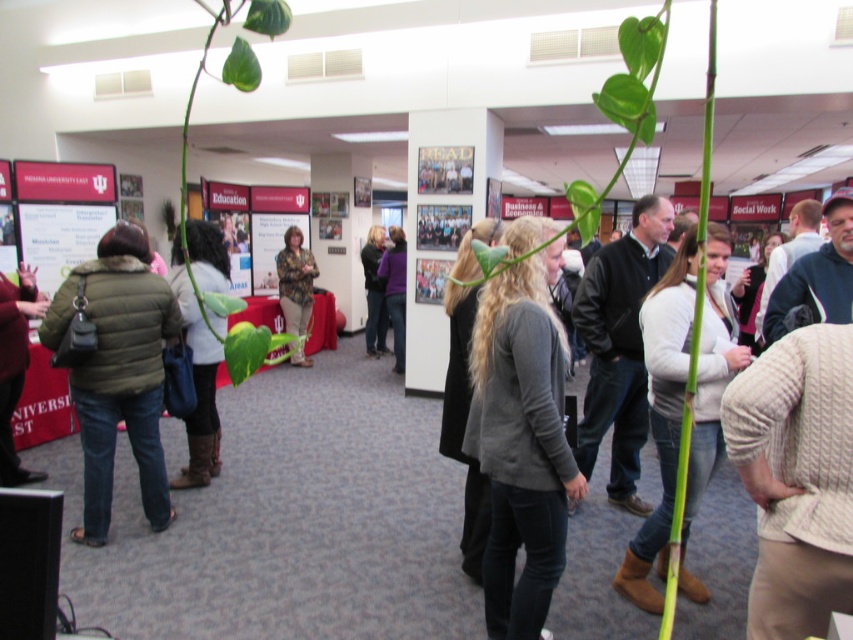
Can you confirm if gray sweater at center is positioned to the left of purple matte jacket at center?

Incorrect, gray sweater at center is not on the left side of purple matte jacket at center.

Who is lower down, gray sweater at center or purple matte jacket at center?

gray sweater at center is below.

This screenshot has height=640, width=853. What do you see at coordinates (521, 432) in the screenshot?
I see `gray sweater at center` at bounding box center [521, 432].

Where is `gray sweater at center`? This screenshot has width=853, height=640. gray sweater at center is located at coordinates (521, 432).

Which of these two, gray sweater at center or dark gray sweater at center, stands shorter?

Standing shorter between the two is gray sweater at center.

This screenshot has height=640, width=853. What are the coordinates of `gray sweater at center` in the screenshot? It's located at (521, 432).

Can you confirm if green fuzzy jacket at left is shorter than white sweater at center?

No.

Does point (155, 499) lie behind point (207, 465)?

No, (155, 499) is in front of (207, 465).

Is point (64, 305) positioned after point (190, 454)?

No, (64, 305) is closer to viewer.

Locate an element on the screen. green fuzzy jacket at left is located at coordinates (119, 372).